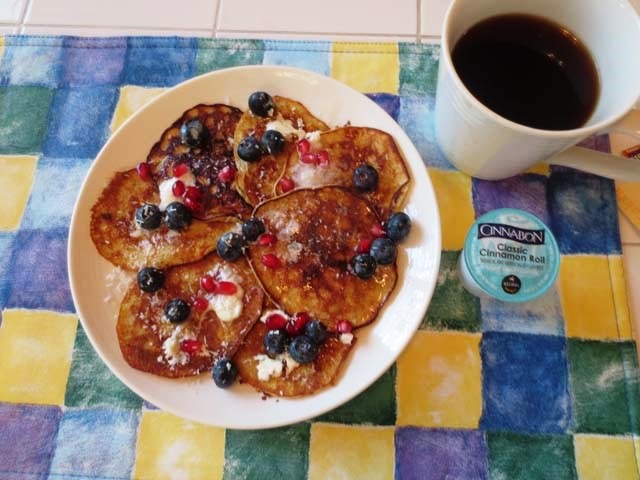
Find the location of a particular element. This screenshot has height=480, width=640. brown liquid in cup is located at coordinates (537, 91).